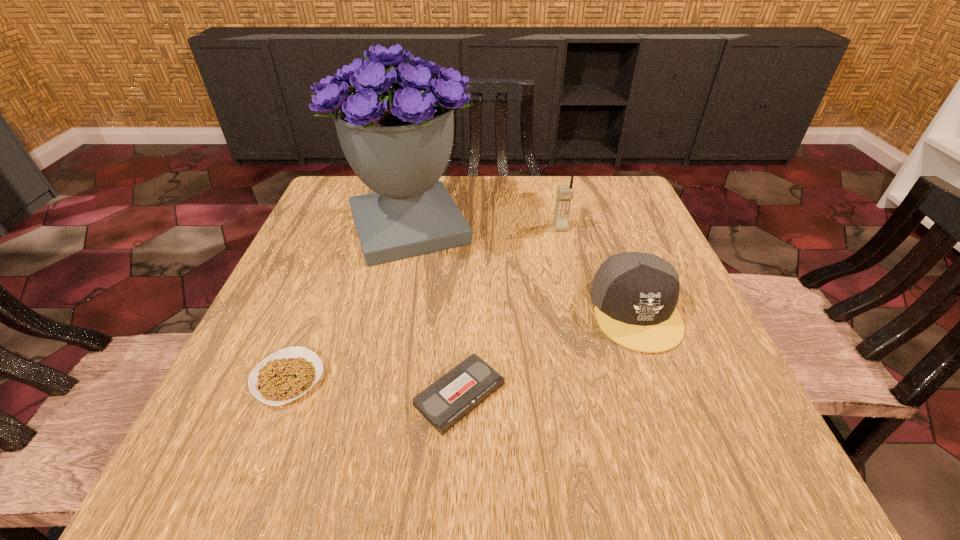
The height and width of the screenshot is (540, 960). Find the location of `the tallest object`. the tallest object is located at coordinates (397, 137).

The width and height of the screenshot is (960, 540). I want to click on the second object from right to left, so click(564, 192).

At what (x,y) coordinates should I click in order to perform the action: click on cellular telephone. Please return your answer as a coordinate pair (x, y). Looking at the image, I should click on (564, 192).

Locate an element on the screen. the rightmost object is located at coordinates (635, 294).

Where is `the third tallest object`? The height and width of the screenshot is (540, 960). the third tallest object is located at coordinates (635, 294).

You are a GUI agent. You are given a task and a screenshot of the screen. Output one action in this format:
    pyautogui.click(x=<x>, y=<y>)
    Task: Click on the second shortest object
    
    Given the screenshot: What is the action you would take?
    pyautogui.click(x=287, y=374)

At what (x,y) coordinates should I click in order to perform the action: click on the shortest object. Please return your answer as a coordinate pair (x, y). The image size is (960, 540). Looking at the image, I should click on (447, 401).

Locate an element on the screen. This screenshot has width=960, height=540. vacant space situated on the front of the bouquet is located at coordinates (382, 342).

The height and width of the screenshot is (540, 960). I want to click on vacant space positioned 0.140m on the front of the fourth shortest object, where the keypad is located, so click(x=571, y=271).

Locate an element on the screen. blank space located on the front-facing side of the cap is located at coordinates (689, 454).